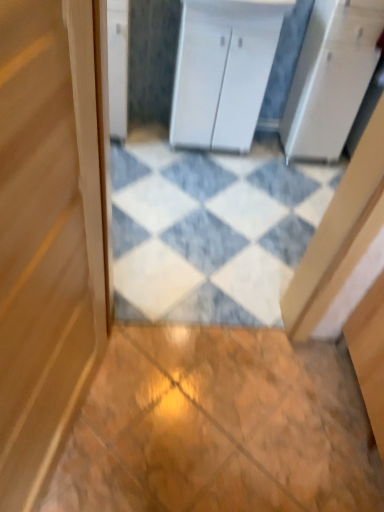
Locate an element on the screen. The width and height of the screenshot is (384, 512). vacant area that lies between white glossy cabinet at upper left, the second cabinetry viewed from the right, and white matte cabinet at center, the first cabinetry positioned from the right is located at coordinates (145, 136).